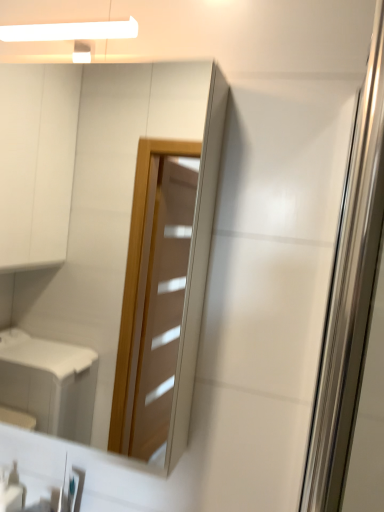
Question: From a real-world perspective, does matte glass mirror at upper center stand above transparent glass screen door at right?

Choices:
 (A) yes
 (B) no

Answer: (A)

Question: Is matte glass mirror at upper center taller than transparent glass screen door at right?

Choices:
 (A) yes
 (B) no

Answer: (A)

Question: Is matte glass mirror at upper center not close to transparent glass screen door at right?

Choices:
 (A) yes
 (B) no

Answer: (A)

Question: Would you say matte glass mirror at upper center contains transparent glass screen door at right?

Choices:
 (A) yes
 (B) no

Answer: (B)

Question: Is matte glass mirror at upper center not inside transparent glass screen door at right?

Choices:
 (A) yes
 (B) no

Answer: (A)

Question: In terms of width, does transparent glass screen door at right look wider or thinner when compared to white glossy soap dispenser at lower left?

Choices:
 (A) thin
 (B) wide

Answer: (A)

Question: From the image's perspective, is transparent glass screen door at right above or below white glossy soap dispenser at lower left?

Choices:
 (A) below
 (B) above

Answer: (B)

Question: Would you say transparent glass screen door at right is inside or outside white glossy soap dispenser at lower left?

Choices:
 (A) outside
 (B) inside

Answer: (A)

Question: Looking at the image, does transparent glass screen door at right seem bigger or smaller compared to white glossy soap dispenser at lower left?

Choices:
 (A) small
 (B) big

Answer: (B)

Question: Is transparent glass screen door at right wider or thinner than matte glass mirror at upper center?

Choices:
 (A) thin
 (B) wide

Answer: (A)

Question: Choose the correct answer: Is transparent glass screen door at right inside matte glass mirror at upper center or outside it?

Choices:
 (A) inside
 (B) outside

Answer: (B)

Question: Is transparent glass screen door at right bigger or smaller than matte glass mirror at upper center?

Choices:
 (A) big
 (B) small

Answer: (B)

Question: From a real-world perspective, relative to matte glass mirror at upper center, is transparent glass screen door at right vertically above or below?

Choices:
 (A) below
 (B) above

Answer: (A)

Question: In terms of height, does white glossy soap dispenser at lower left look taller or shorter compared to matte glass mirror at upper center?

Choices:
 (A) tall
 (B) short

Answer: (B)

Question: In the image, is white glossy soap dispenser at lower left positioned in front of or behind matte glass mirror at upper center?

Choices:
 (A) front
 (B) behind

Answer: (B)